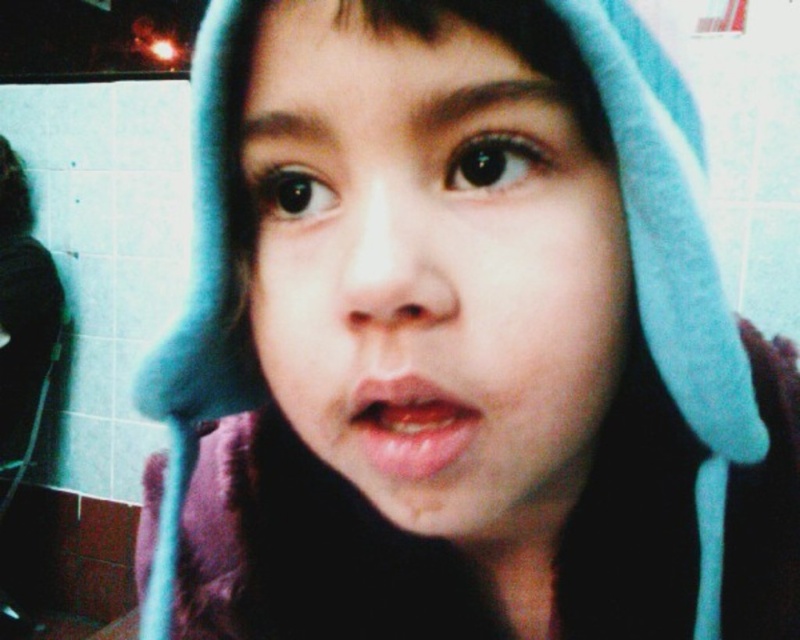
Question: Which point is farther to the camera?

Choices:
 (A) smooth skin face at center
 (B) smooth glossy lips at center

Answer: (B)

Question: From the image, what is the correct spatial relationship of smooth skin face at center in relation to smooth glossy lips at center?

Choices:
 (A) left
 (B) right

Answer: (B)

Question: Can you confirm if smooth skin face at center is positioned below smooth glossy lips at center?

Choices:
 (A) yes
 (B) no

Answer: (B)

Question: Which of the following is the farthest from the observer?

Choices:
 (A) smooth glossy lips at center
 (B) smooth skin face at center

Answer: (A)

Question: Is smooth skin face at center to the left of smooth glossy lips at center from the viewer's perspective?

Choices:
 (A) yes
 (B) no

Answer: (B)